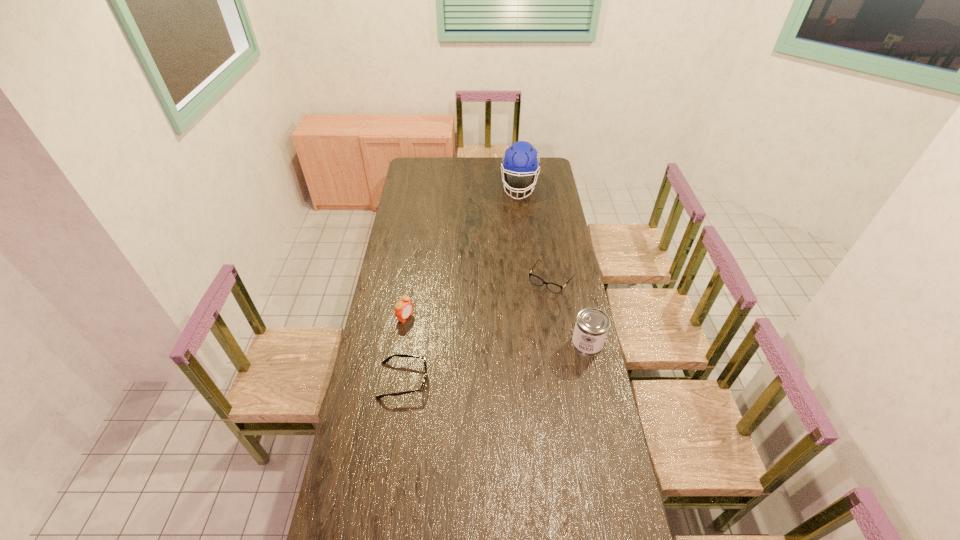
Where is `vacant space that's between the football helmet and the farther spectacles`? vacant space that's between the football helmet and the farther spectacles is located at coordinates (536, 233).

The height and width of the screenshot is (540, 960). What are the coordinates of `empty space that is in between the third tallest object and the football helmet` in the screenshot? It's located at (462, 252).

Identify the location of empty location between the third farthest object and the left spectacles. The width and height of the screenshot is (960, 540). (404, 349).

You are a GUI agent. You are given a task and a screenshot of the screen. Output one action in this format:
    pyautogui.click(x=<x>, y=<y>)
    Task: Click on the object that stands as the second closest to the fourth shortest object
    
    Given the screenshot: What is the action you would take?
    pyautogui.click(x=386, y=360)

Identify which object is the second nearest to the football helmet. Please provide its 2D coordinates. Your answer should be formatted as a tuple, i.e. [(x, y)], where the tuple contains the x and y coordinates of a point satisfying the conditions above.

[(403, 308)]

Where is `vacant position in the image that satisfies the following two spatial constraints: 1. on the front side of the second nearest object; 2. on the left side of the right spectacles`? The height and width of the screenshot is (540, 960). vacant position in the image that satisfies the following two spatial constraints: 1. on the front side of the second nearest object; 2. on the left side of the right spectacles is located at coordinates click(562, 343).

Image resolution: width=960 pixels, height=540 pixels. Identify the location of free spot that satisfies the following two spatial constraints: 1. on the front side of the third tallest object; 2. on the right side of the fourth shortest object. (401, 343).